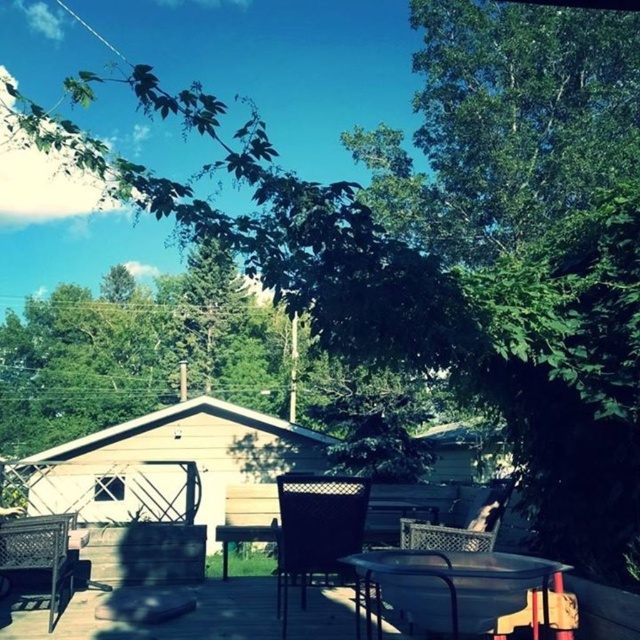
Question: Can you confirm if wooden deck at lower center is wider than metallic silver table at lower center?

Choices:
 (A) yes
 (B) no

Answer: (A)

Question: Which point is farther to the camera?

Choices:
 (A) tan wood cabin at center
 (B) metallic wire chair at center
 (C) woven plastic chair at center
 (D) wooden deck at lower center

Answer: (A)

Question: Is wooden deck at lower center above black woven chair at center?

Choices:
 (A) yes
 (B) no

Answer: (B)

Question: Which point is closer to the camera taking this photo?

Choices:
 (A) (204, 397)
 (B) (474, 544)
 (C) (499, 518)

Answer: (B)

Question: Can you confirm if tan wood cabin at center is positioned to the left of metallic silver table at lower center?

Choices:
 (A) no
 (B) yes

Answer: (B)

Question: Which object appears closest to the camera in this image?

Choices:
 (A) metallic wire chair at center
 (B) tan wood cabin at center
 (C) rustic wicker chair at lower left
 (D) metallic silver table at lower center

Answer: (D)